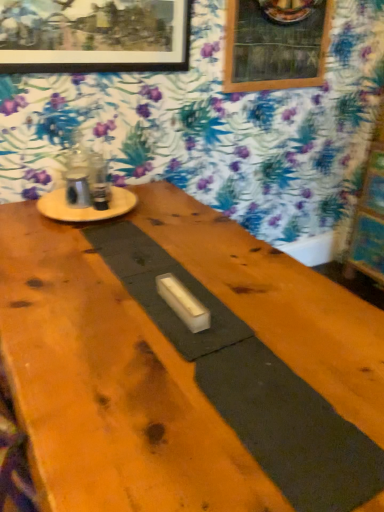
Locate an element on the screen. Image resolution: width=384 pixels, height=512 pixels. vacant area on top of smooth wood table at center (from a real-world perspective) is located at coordinates (223, 344).